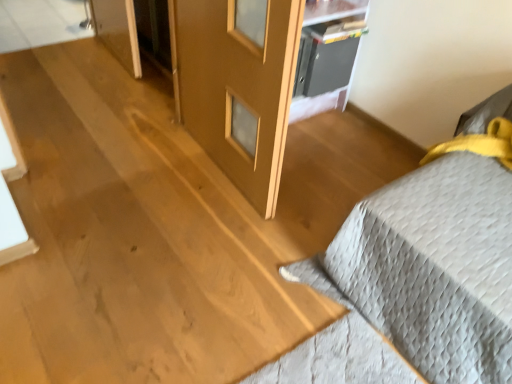
Question: Does gray quilted bedspread at right have a greater height compared to matte wood screen door at center?

Choices:
 (A) yes
 (B) no

Answer: (B)

Question: Is gray quilted bedspread at right at the right side of matte wood screen door at center?

Choices:
 (A) no
 (B) yes

Answer: (B)

Question: Considering the relative sizes of gray quilted bedspread at right and matte wood screen door at center in the image provided, is gray quilted bedspread at right thinner than matte wood screen door at center?

Choices:
 (A) yes
 (B) no

Answer: (B)

Question: Is gray quilted bedspread at right wider than matte wood screen door at center?

Choices:
 (A) yes
 (B) no

Answer: (A)

Question: Is the depth of gray quilted bedspread at right less than that of matte wood screen door at center?

Choices:
 (A) yes
 (B) no

Answer: (A)

Question: Does point (456, 170) appear closer or farther from the camera than point (176, 16)?

Choices:
 (A) closer
 (B) farther

Answer: (A)

Question: From the image's perspective, is gray quilted bedspread at right positioned above or below matte wood screen door at center?

Choices:
 (A) below
 (B) above

Answer: (A)

Question: In terms of height, does gray quilted bedspread at right look taller or shorter compared to matte wood screen door at center?

Choices:
 (A) tall
 (B) short

Answer: (B)

Question: In terms of width, does gray quilted bedspread at right look wider or thinner when compared to matte wood screen door at center?

Choices:
 (A) wide
 (B) thin

Answer: (A)

Question: In terms of width, does metallic gray cabinet at upper center look wider or thinner when compared to matte wood screen door at center?

Choices:
 (A) thin
 (B) wide

Answer: (B)

Question: From a real-world perspective, is metallic gray cabinet at upper center physically located above or below matte wood screen door at center?

Choices:
 (A) below
 (B) above

Answer: (A)

Question: Is metallic gray cabinet at upper center to the left or to the right of matte wood screen door at center in the image?

Choices:
 (A) right
 (B) left

Answer: (A)

Question: Is metallic gray cabinet at upper center inside the boundaries of matte wood screen door at center, or outside?

Choices:
 (A) inside
 (B) outside

Answer: (B)

Question: From the image's perspective, is matte wood screen door at center positioned above or below gray quilted bedspread at right?

Choices:
 (A) above
 (B) below

Answer: (A)

Question: Considering the positions of matte wood screen door at center and gray quilted bedspread at right in the image, is matte wood screen door at center bigger or smaller than gray quilted bedspread at right?

Choices:
 (A) big
 (B) small

Answer: (B)